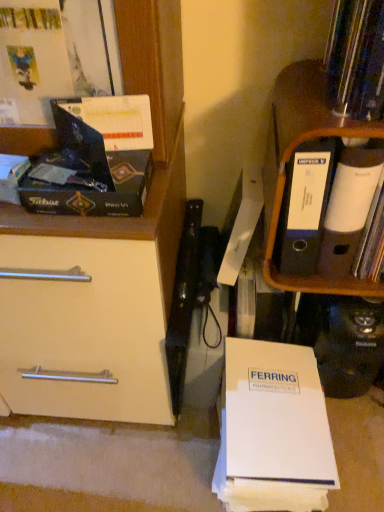
What do you see at coordinates (349, 208) in the screenshot? I see `white paper at upper right, which is the second paperback book from top to bottom` at bounding box center [349, 208].

Where is `orange wood shelf at right`? orange wood shelf at right is located at coordinates (294, 151).

I want to click on matte black box at left, so pos(95,190).

Measure the distance between point (x=103, y=129) and camera.

They are 28.78 inches apart.

What do you see at coordinates (103, 129) in the screenshot?
I see `matte black book at upper left, the third paperback book from the right` at bounding box center [103, 129].

Find the location of `matte black book at upper left`. matte black book at upper left is located at coordinates (12, 176).

Is matte black box at left outside of matte black book at upper left?

A: Yes, matte black box at left is located beyond the bounds of matte black book at upper left.

From their relative heights in the image, would you say matte black box at left is taller or shorter than matte black book at upper left?

matte black box at left is shorter than matte black book at upper left.

Considering the positions of point (77, 211) and point (11, 155), is point (77, 211) closer or farther from the camera than point (11, 155)?

Point (77, 211) is closer to the camera than point (11, 155).

Considering their positions, is matte black box at left located in front of or behind matte black book at upper left?

matte black box at left is in front of matte black book at upper left.

Which is more to the left, white paper at upper right, marked as the 3th paperback book in a left-to-right arrangement, or matte black book at upper left?

matte black book at upper left is more to the left.

From the image's perspective, is white paper at upper right, the 1th paperback book positioned from the right, on top of matte black book at upper left?

Yes, from the image's perspective, white paper at upper right, the 1th paperback book positioned from the right, is on top of matte black book at upper left.

Is white paper at upper right, arranged as the 2th paperback book when ordered from the bottom, aimed at matte black book at upper left?

No, white paper at upper right, arranged as the 2th paperback book when ordered from the bottom, is not oriented towards matte black book at upper left.

Considering the points (380, 172) and (304, 88), which point is behind, point (380, 172) or point (304, 88)?

Point (304, 88)

Considering the relative sizes of white paper at upper right, the 1th paperback book positioned from the right, and orange wood shelf at right in the image provided, is white paper at upper right, the 1th paperback book positioned from the right, thinner than orange wood shelf at right?

Indeed, white paper at upper right, the 1th paperback book positioned from the right, has a lesser width compared to orange wood shelf at right.

Is white paper at upper right, arranged as the 2th paperback book when ordered from the bottom, not within orange wood shelf at right?

Indeed, white paper at upper right, arranged as the 2th paperback book when ordered from the bottom, is completely outside orange wood shelf at right.

From the image's perspective, is orange wood shelf at right located above or below white paper at upper right, the 1th paperback book positioned from the right?

Based on their image positions, orange wood shelf at right is located above white paper at upper right, the 1th paperback book positioned from the right.

Between orange wood shelf at right and white paper at upper right, marked as the 3th paperback book in a left-to-right arrangement, which one appears on the right side from the viewer's perspective?

Positioned to the right is white paper at upper right, marked as the 3th paperback book in a left-to-right arrangement.

There is a orange wood shelf at right. Identify the location of the 1st paperback book below it (from a real-world perspective). This screenshot has width=384, height=512. (349, 208).

In terms of height, does orange wood shelf at right look taller or shorter compared to white paper at upper right, the 1th paperback book positioned from the right?

Clearly, orange wood shelf at right is taller compared to white paper at upper right, the 1th paperback book positioned from the right.

Consider the image. From the image's perspective, which one is positioned lower, matte black book at upper left or matte black book at upper left, arranged as the first paperback book when viewed from the top?

From the image's view, matte black book at upper left is below.

From a real-world perspective, is matte black book at upper left beneath matte black book at upper left, arranged as the first paperback book when viewed from the top?

Yes.

Consider the image. Is matte black book at upper left oriented away from matte black book at upper left, arranged as the first paperback book when viewed from the top?

No, matte black book at upper left, arranged as the first paperback book when viewed from the top, is not at the back of matte black book at upper left.

Between matte black book at upper left and matte black book at upper left, acting as the third paperback book starting from the bottom, which one is positioned behind?

matte black book at upper left is behind.

I want to click on the 1st paperback book to the left of the orange wood shelf at right, counting from the anchor's position, so click(x=276, y=415).

Can you tell me how much white paper at lower center, which ranks as the second paperback book in left-to-right order, and orange wood shelf at right differ in facing direction?

There is a 2.11-degree angle between the facing directions of white paper at lower center, which ranks as the second paperback book in left-to-right order, and orange wood shelf at right.

Consider the image. Considering the sizes of objects white paper at lower center, which ranks as the second paperback book in left-to-right order, and orange wood shelf at right in the image provided, who is smaller, white paper at lower center, which ranks as the second paperback book in left-to-right order, or orange wood shelf at right?

orange wood shelf at right.

Is white paper at lower center, the first paperback book when ordered from bottom to top, in front of or behind orange wood shelf at right in the image?

In the image, white paper at lower center, the first paperback book when ordered from bottom to top, appears behind orange wood shelf at right.

How much distance is there between white paper at lower center, the first paperback book when ordered from bottom to top, and matte black book at upper left?

The distance of white paper at lower center, the first paperback book when ordered from bottom to top, from matte black book at upper left is 67.81 centimeters.

Does point (270, 447) appear closer or farther from the camera than point (5, 191)?

Point (270, 447) is positioned farther from the camera compared to point (5, 191).

Can you see white paper at lower center, the first paperback book when ordered from bottom to top, touching matte black book at upper left?

No, white paper at lower center, the first paperback book when ordered from bottom to top, is not making contact with matte black book at upper left.

Is white paper at lower center, arranged as the second paperback book when viewed from the right, further to camera compared to matte black book at upper left?

Yes, it is behind matte black book at upper left.

Identify the location of book to the left of matte black box at left. (12, 176).

Locate an element on the screen. The image size is (384, 512). the 1st paperback book located beneath the matte black book at upper left (from a real-world perspective) is located at coordinates (349, 208).

Estimate the real-world distances between objects in this image. Which object is further from matte black box at left, matte black book at upper left or orange wood shelf at right?

Among the two, orange wood shelf at right is located further to matte black box at left.

From the image, which object appears to be farther from orange wood shelf at right, white paper at lower center, which is counted as the third paperback book, starting from the top, or matte black book at upper left?

matte black book at upper left is positioned further to the anchor orange wood shelf at right.

From the image, which object appears to be farther from orange wood shelf at right, matte black box at left or matte black book at upper left?

Among the two, matte black book at upper left is located further to orange wood shelf at right.

Looking at the image, which one is located further to matte black box at left, matte black book at upper left, arranged as the first paperback book when viewed from the top, or matte black book at upper left?

Based on the image, matte black book at upper left appears to be further to matte black box at left.

From the image, which object appears to be farther from white paper at upper right, arranged as the 2th paperback book when ordered from the bottom, matte black box at left or matte black book at upper left, the first paperback book in the left-to-right sequence?

Among the two, matte black book at upper left, the first paperback book in the left-to-right sequence, is located further to white paper at upper right, arranged as the 2th paperback book when ordered from the bottom.

Considering their positions, is orange wood shelf at right positioned closer to white paper at lower center, which is counted as the third paperback book, starting from the top, than matte black book at upper left?

orange wood shelf at right is closer to white paper at lower center, which is counted as the third paperback book, starting from the top.

Which object lies nearer to the anchor point white paper at upper right, arranged as the 2th paperback book when ordered from the bottom, matte black book at upper left or matte black box at left?

matte black box at left lies closer to white paper at upper right, arranged as the 2th paperback book when ordered from the bottom, than the other object.

Based on their spatial positions, is orange wood shelf at right or white paper at upper right, the 1th paperback book positioned from the right, further from matte black box at left?

The object further to matte black box at left is white paper at upper right, the 1th paperback book positioned from the right.

In order to click on paperback book between matte black book at upper left, arranged as the first paperback book when viewed from the top, and white paper at lower center, the first paperback book when ordered from bottom to top, in the up-down direction in this screenshot , I will do `click(349, 208)`.

Where is `box between matte black book at upper left and white paper at upper right, arranged as the 2th paperback book when ordered from the bottom, in the horizontal direction`? This screenshot has width=384, height=512. box between matte black book at upper left and white paper at upper right, arranged as the 2th paperback book when ordered from the bottom, in the horizontal direction is located at coordinates (95, 190).

I want to click on box between orange wood shelf at right and white paper at lower center, which ranks as the second paperback book in left-to-right order, in the up-down direction, so click(x=95, y=190).

The height and width of the screenshot is (512, 384). In order to click on shelf located between matte black box at left and white paper at upper right, which is the second paperback book from top to bottom, in the left-right direction in this screenshot , I will do `click(294, 151)`.